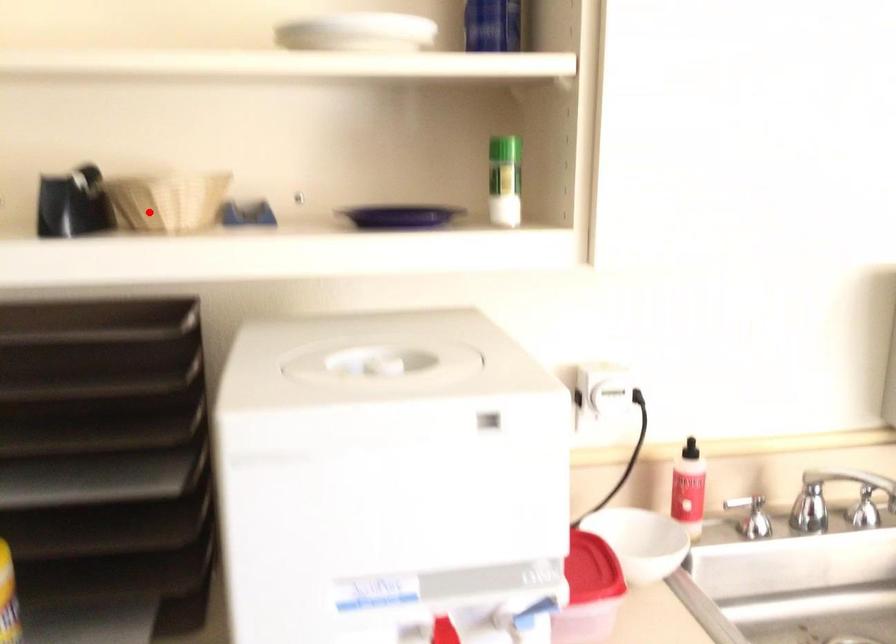
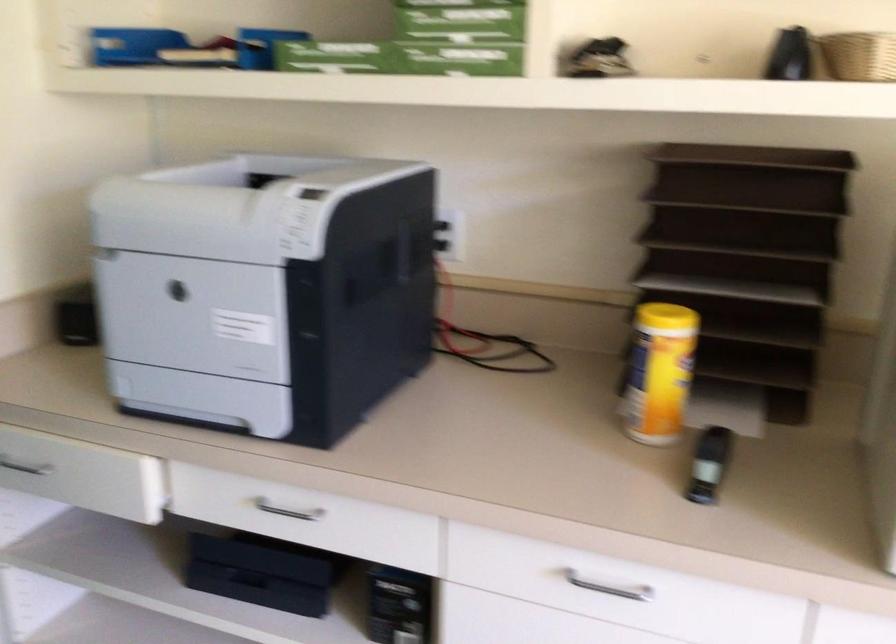
Find the pixel in the second image that matches the highlighted location in the first image.

(858, 55)